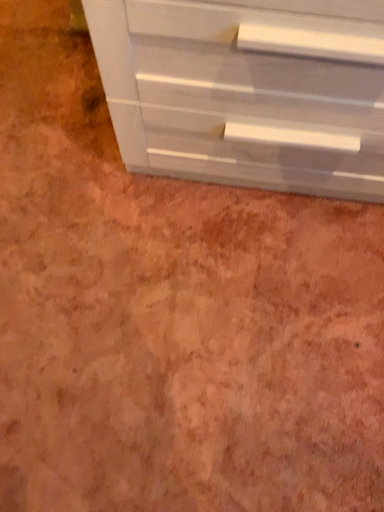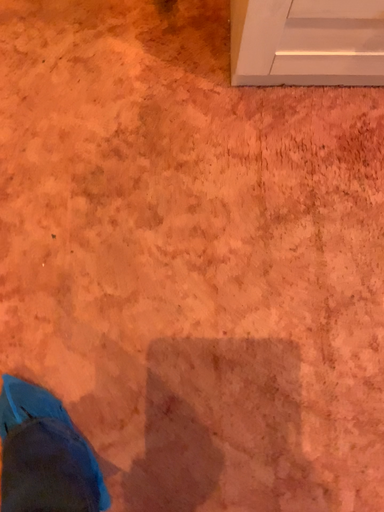
Question: Which way did the camera rotate in the video?

Choices:
 (A) rotated downward
 (B) rotated upward

Answer: (A)